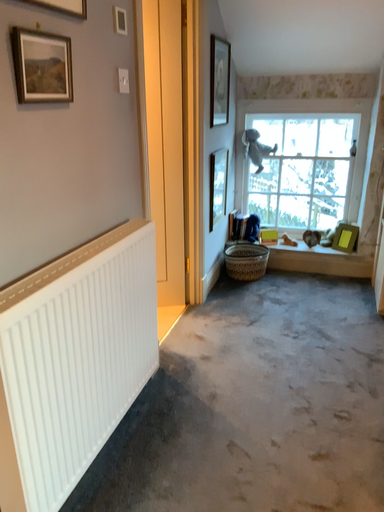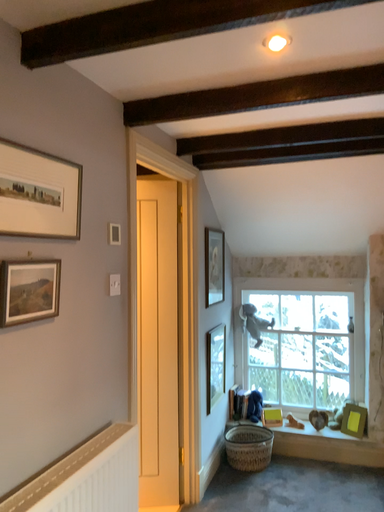
Question: Which way did the camera rotate in the video?

Choices:
 (A) rotated upward
 (B) rotated downward

Answer: (A)